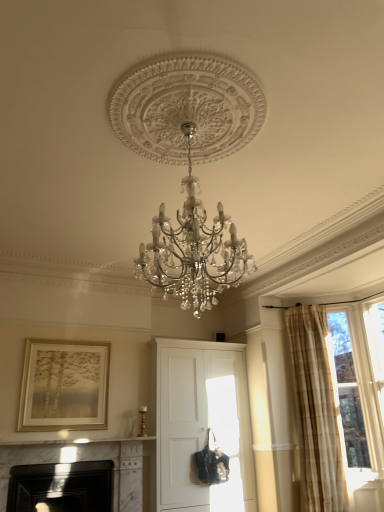
Question: Does white matte cabinet at center have a greater height compared to beige plaid curtain at right?

Choices:
 (A) yes
 (B) no

Answer: (B)

Question: From the image's perspective, does white matte cabinet at center appear higher than beige plaid curtain at right?

Choices:
 (A) yes
 (B) no

Answer: (B)

Question: Is beige plaid curtain at right inside white matte cabinet at center?

Choices:
 (A) yes
 (B) no

Answer: (B)

Question: Is beige plaid curtain at right at the back of white matte cabinet at center?

Choices:
 (A) no
 (B) yes

Answer: (A)

Question: From the image's perspective, is white matte cabinet at center located beneath beige plaid curtain at right?

Choices:
 (A) no
 (B) yes

Answer: (B)

Question: From a real-world perspective, is beige plaid curtain at right physically located above or below gold metallic picture frame at upper left?

Choices:
 (A) below
 (B) above

Answer: (A)

Question: In terms of width, does beige plaid curtain at right look wider or thinner when compared to gold metallic picture frame at upper left?

Choices:
 (A) wide
 (B) thin

Answer: (A)

Question: Considering the positions of point (294, 367) and point (99, 372), is point (294, 367) closer or farther from the camera than point (99, 372)?

Choices:
 (A) closer
 (B) farther

Answer: (B)

Question: Is beige plaid curtain at right situated inside gold metallic picture frame at upper left or outside?

Choices:
 (A) outside
 (B) inside

Answer: (A)

Question: From the image's perspective, relative to white marble fireplace at lower left, placed as the second fireplace when sorted from left to right, is clear glass window at upper right above or below?

Choices:
 (A) below
 (B) above

Answer: (B)

Question: Is clear glass window at upper right inside the boundaries of white marble fireplace at lower left, which appears as the 1th fireplace when viewed from the right, or outside?

Choices:
 (A) inside
 (B) outside

Answer: (B)

Question: From their relative heights in the image, would you say clear glass window at upper right is taller or shorter than white marble fireplace at lower left, which appears as the 1th fireplace when viewed from the right?

Choices:
 (A) short
 (B) tall

Answer: (B)

Question: Is point (344, 372) closer or farther from the camera than point (130, 449)?

Choices:
 (A) farther
 (B) closer

Answer: (A)

Question: From a real-world perspective, is black marble fireplace at lower left, the 1th fireplace positioned from the left, positioned above or below white matte cabinet at center?

Choices:
 (A) below
 (B) above

Answer: (A)

Question: Based on their positions, is black marble fireplace at lower left, the 1th fireplace positioned from the left, located to the left or right of white matte cabinet at center?

Choices:
 (A) left
 (B) right

Answer: (A)